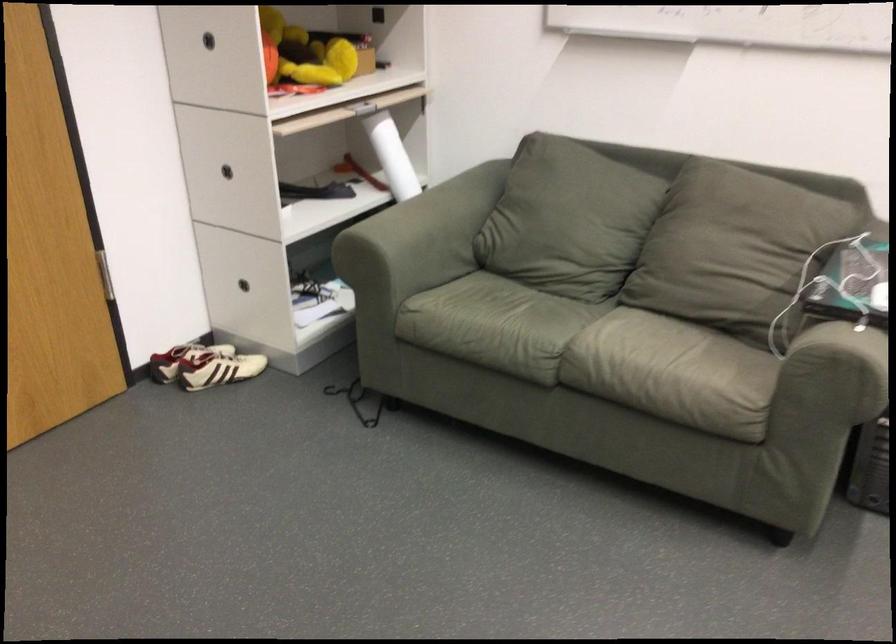
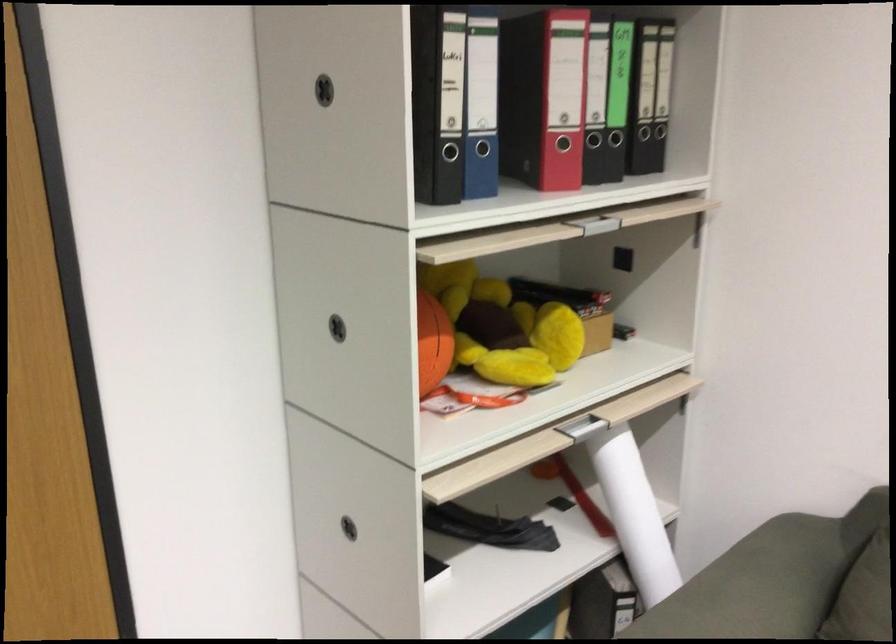
The point at (369, 107) is marked in the first image. Where is the corresponding point in the second image?

(595, 421)